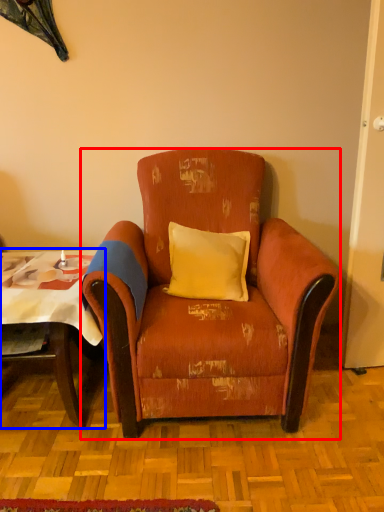
Question: Which of the following is the farthest to the observer, chair (highlighted by a red box) or table (highlighted by a blue box)?

Choices:
 (A) chair
 (B) table

Answer: (B)